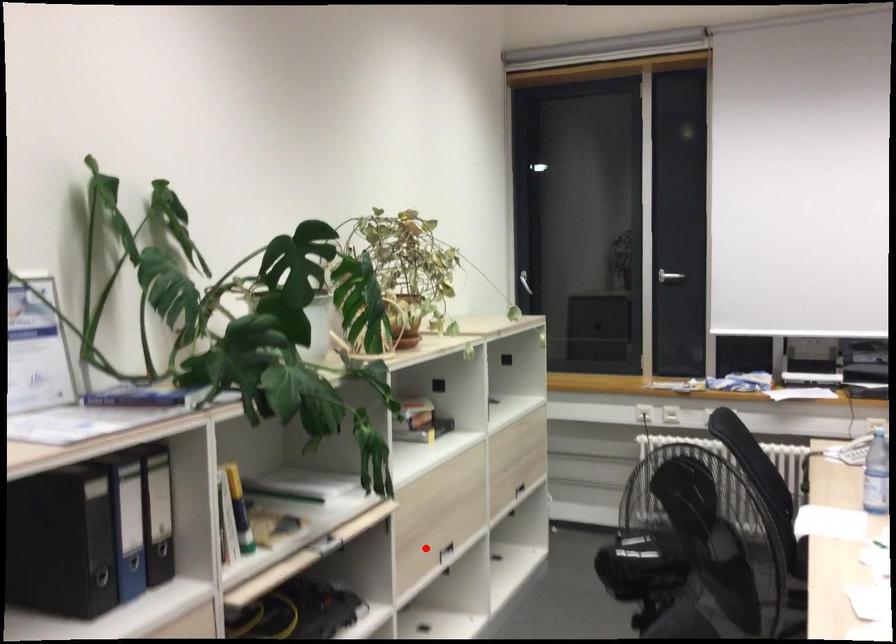
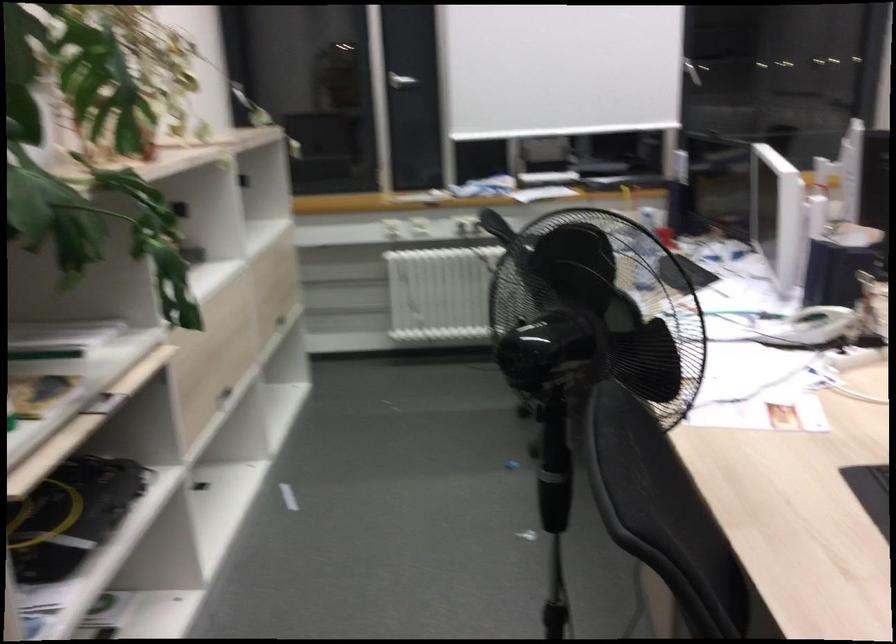
Locate, in the second image, the point that corresponds to the highlighted location in the first image.

(211, 395)